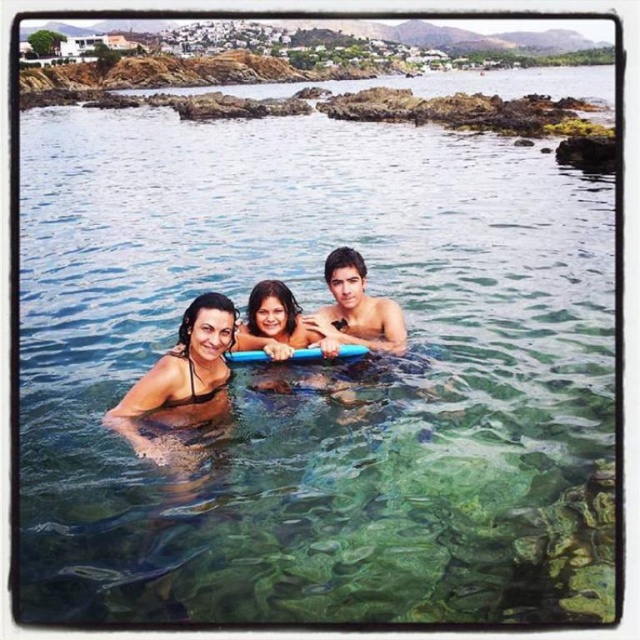
You are a photographer taking a picture of the two points in the coastal scene. Which point, point (212, 340) or point (381, 305), will appear larger in the photo?

Point (212, 340) will appear larger in the photo because it is closer to the camera than point (381, 305).

You are a photographer taking a picture of the black matte swimwear at center and the smooth skin man at center. Which object is closer to the camera?

The black matte swimwear at center is positioned under the smooth skin man at center, so the smooth skin man at center is closer to the camera.

Based on the photo, you are a photographer on the beach and want to capture a photo of the black matte swimwear at center and the smooth skin man at center. Based on their positions, which one should you focus on first if you want to include both in the frame without moving the camera?

The black matte swimwear at center is to the left of the smooth skin man at center, so you should focus on the smooth skin man at center first to ensure both are in the frame without moving the camera.